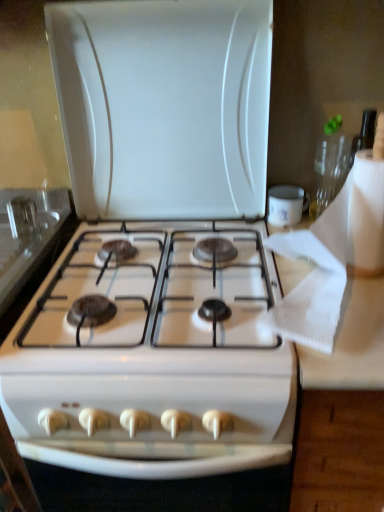
Question: Would you say white paper towel at right is to the left or to the right of white glossy gas stove at center in the picture?

Choices:
 (A) left
 (B) right

Answer: (B)

Question: From their relative heights in the image, would you say white paper towel at right is taller or shorter than white glossy gas stove at center?

Choices:
 (A) tall
 (B) short

Answer: (A)

Question: Does point (332, 346) appear closer or farther from the camera than point (213, 448)?

Choices:
 (A) closer
 (B) farther

Answer: (A)

Question: Considering their positions, is white glossy gas stove at center located in front of or behind white paper towel at right?

Choices:
 (A) front
 (B) behind

Answer: (B)

Question: Is point (31, 433) positioned closer to the camera than point (307, 238)?

Choices:
 (A) farther
 (B) closer

Answer: (B)

Question: In terms of width, does white glossy gas stove at center look wider or thinner when compared to white paper towel at right?

Choices:
 (A) wide
 (B) thin

Answer: (A)

Question: In the image, is white glossy gas stove at center on the left side or the right side of white paper towel at right?

Choices:
 (A) left
 (B) right

Answer: (A)